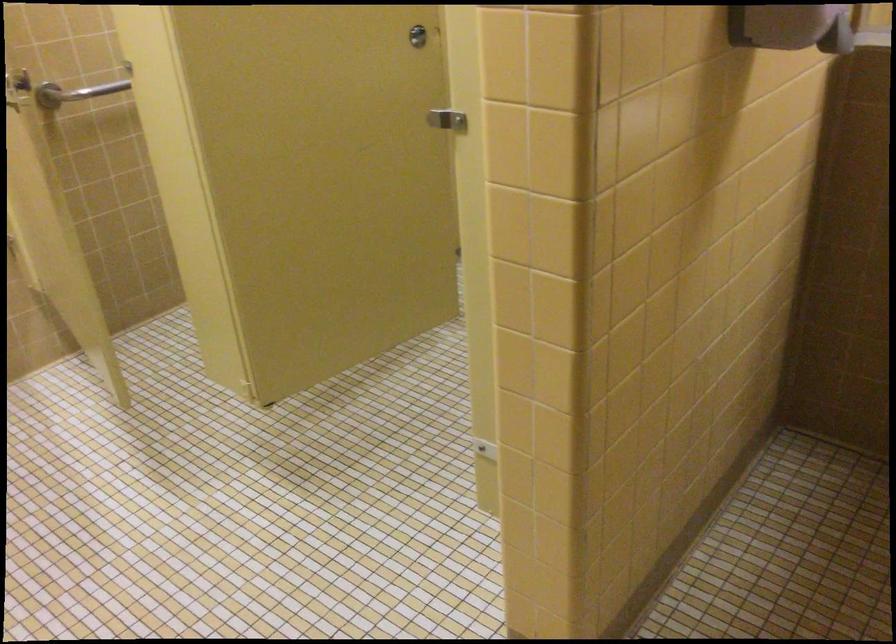
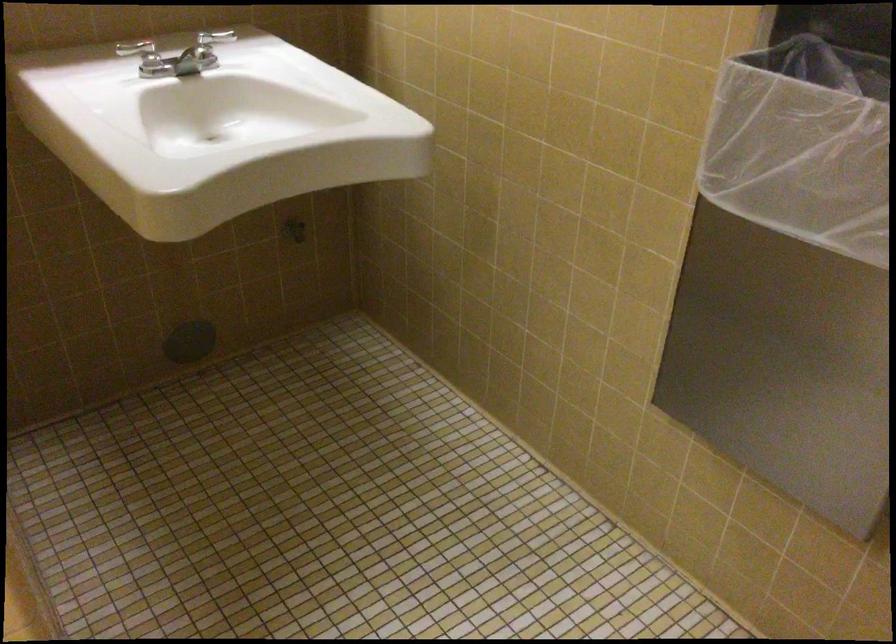
The first image is from the beginning of the video and the second image is from the end. How did the camera likely rotate when shooting the video?

The rotation direction of the camera is right-down.